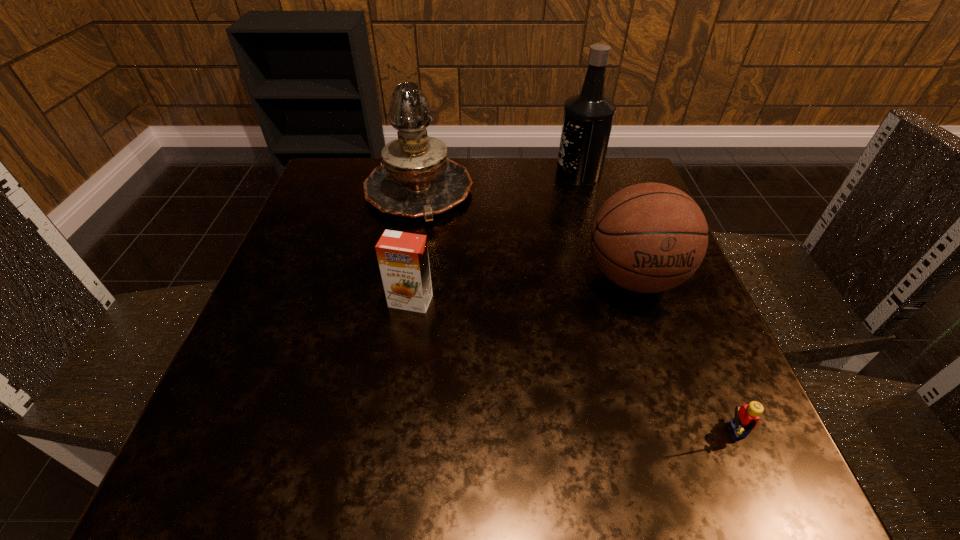
In order to click on vacant space at the near left corner in this screenshot , I will do `click(227, 482)`.

Image resolution: width=960 pixels, height=540 pixels. I want to click on vacant space at the near right corner, so click(758, 455).

Image resolution: width=960 pixels, height=540 pixels. In order to click on free space between the shortest object and the fourth shortest object in this screenshot , I will do `click(571, 312)`.

Find the location of a particular element. This screenshot has width=960, height=540. free area in between the third shortest object and the orange juice is located at coordinates (522, 289).

In order to click on vacant point located between the basketball and the fourth tallest object in this screenshot , I will do `click(522, 289)`.

At what (x,y) coordinates should I click in order to perform the action: click on empty space between the shortest object and the second tallest object. Please return your answer as a coordinate pair (x, y). The image size is (960, 540). Looking at the image, I should click on (571, 312).

This screenshot has width=960, height=540. I want to click on vacant space in between the fourth tallest object and the tallest object, so click(x=494, y=237).

The width and height of the screenshot is (960, 540). What are the coordinates of `unoccupied position between the second shortest object and the basketball` in the screenshot? It's located at (522, 289).

Locate an element on the screen. This screenshot has width=960, height=540. the second closest object relative to the tallest object is located at coordinates (650, 237).

Select which object is the fourth closest to the tallest object. Please provide its 2D coordinates. Your answer should be formatted as a tuple, i.e. [(x, y)], where the tuple contains the x and y coordinates of a point satisfying the conditions above.

[(746, 418)]